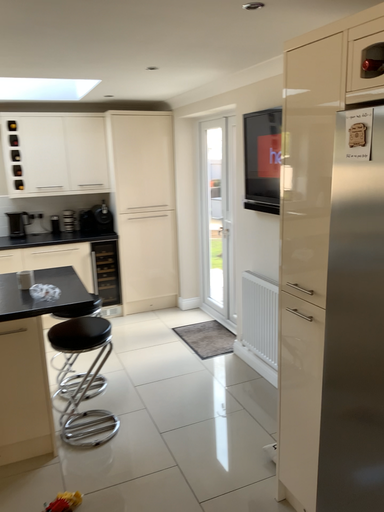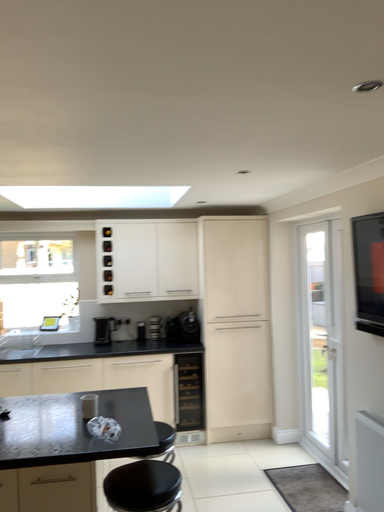
Question: Which way did the camera rotate in the video?

Choices:
 (A) rotated downward
 (B) rotated upward

Answer: (B)